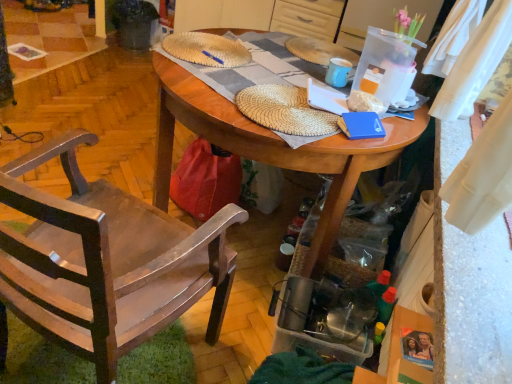
The image size is (512, 384). What are the coordinates of `vacant space in between matte blue mug at upper center and woven straw hat at upper center, marked as the second hat in a front-to-back arrangement` in the screenshot? It's located at (281, 66).